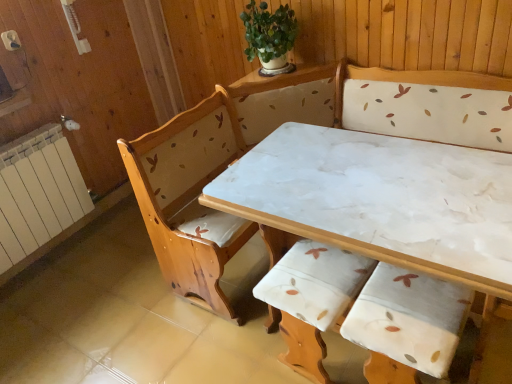
Question: Is white marble table at center in contact with green leafy plant at upper center?

Choices:
 (A) no
 (B) yes

Answer: (A)

Question: Does white marble table at center turn towards green leafy plant at upper center?

Choices:
 (A) yes
 (B) no

Answer: (B)

Question: Considering the relative positions of white marble table at center and green leafy plant at upper center in the image provided, is white marble table at center to the left of green leafy plant at upper center from the viewer's perspective?

Choices:
 (A) no
 (B) yes

Answer: (A)

Question: Does white marble table at center have a smaller size compared to green leafy plant at upper center?

Choices:
 (A) yes
 (B) no

Answer: (B)

Question: Can we say white marble table at center lies outside green leafy plant at upper center?

Choices:
 (A) yes
 (B) no

Answer: (A)

Question: Is wooden armchair with floral upholstery at center spatially inside white painted radiator at left, or outside of it?

Choices:
 (A) inside
 (B) outside

Answer: (B)

Question: In terms of height, does wooden armchair with floral upholstery at center look taller or shorter compared to white painted radiator at left?

Choices:
 (A) short
 (B) tall

Answer: (A)

Question: Is point (318, 339) positioned closer to the camera than point (31, 203)?

Choices:
 (A) farther
 (B) closer

Answer: (B)

Question: From the image's perspective, is wooden armchair with floral upholstery at center above or below white painted radiator at left?

Choices:
 (A) above
 (B) below

Answer: (B)

Question: Based on their positions, is wooden armchair with floral upholstery at center located to the left or right of white marble table at center?

Choices:
 (A) right
 (B) left

Answer: (B)

Question: Is point (310, 261) closer or farther from the camera than point (348, 248)?

Choices:
 (A) closer
 (B) farther

Answer: (B)

Question: Looking at the image, does wooden armchair with floral upholstery at center seem bigger or smaller compared to white marble table at center?

Choices:
 (A) big
 (B) small

Answer: (B)

Question: From a real-world perspective, is wooden armchair with floral upholstery at center above or below white marble table at center?

Choices:
 (A) above
 (B) below

Answer: (B)

Question: Visually, is green leafy plant at upper center positioned to the left or to the right of white painted radiator at left?

Choices:
 (A) left
 (B) right

Answer: (B)

Question: In the image, is green leafy plant at upper center positioned in front of or behind white painted radiator at left?

Choices:
 (A) front
 (B) behind

Answer: (B)